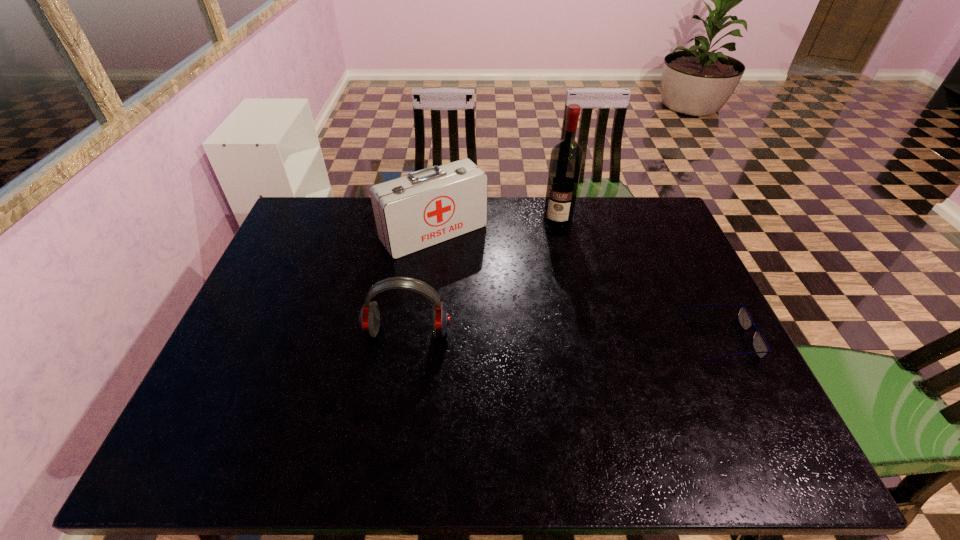
The height and width of the screenshot is (540, 960). In order to click on vacant space at the far left corner of the desktop in this screenshot , I will do `click(341, 217)`.

In the image, there is a desktop. Find the location of `free space at the far right corner`. free space at the far right corner is located at coordinates (660, 211).

Image resolution: width=960 pixels, height=540 pixels. What are the coordinates of `blank area at the near right corner` in the screenshot? It's located at (760, 418).

Identify the location of free space between the first-aid kit and the rightmost object. Image resolution: width=960 pixels, height=540 pixels. (577, 286).

At what (x,y) coordinates should I click in order to perform the action: click on free spot between the tallest object and the first-aid kit. Please return your answer as a coordinate pair (x, y). Looking at the image, I should click on [x=495, y=227].

What are the coordinates of `free point between the first-aid kit and the second object from right to left` in the screenshot? It's located at (495, 227).

The image size is (960, 540). I want to click on free space that is in between the first-aid kit and the alcohol, so click(495, 227).

Where is `vacant region between the rightmost object and the first-aid kit`? The height and width of the screenshot is (540, 960). vacant region between the rightmost object and the first-aid kit is located at coordinates (577, 286).

Where is `free space between the first-aid kit and the tallest object`? Image resolution: width=960 pixels, height=540 pixels. free space between the first-aid kit and the tallest object is located at coordinates (495, 227).

Identify the location of free space between the third tallest object and the shortest object. (564, 334).